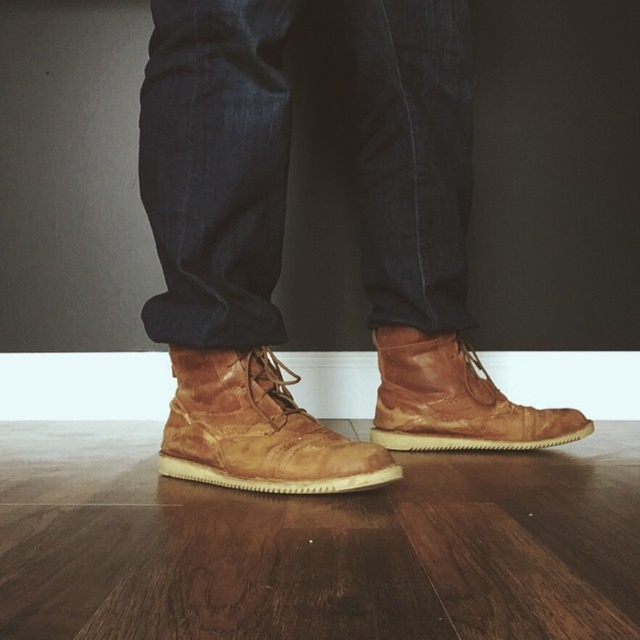
You are standing in a room and want to reach a specific point on the floor marked at coordinates point (177, 353). If you take a step forward of 2 feet, will you be closer to the point?

The distance between point (177, 353) and the viewer is 3.37 feet. After taking a step forward of 2 feet, you will be 1.37 feet away from the point, so yes, you will be closer.

You are a fashion designer analyzing the placement of clothing items in the image. The dark blue denim jeans at center are represented by point (216, 170). Where would you place the brown leather boots in relation to this point?

The dark blue denim jeans at center are represented by point (216, 170). The brown leather boots would be placed below this point since they are the shoes underneath the jeans.